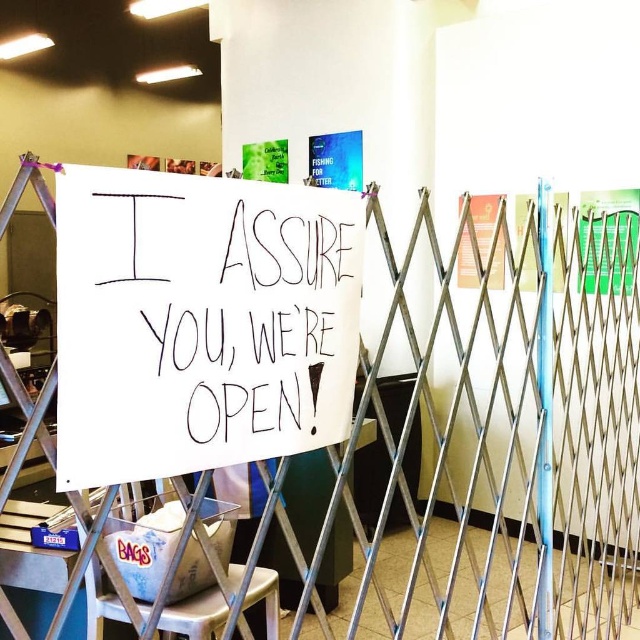
Does white paper sign at center have a greater height compared to metallic silver pole at right?

Incorrect, white paper sign at center's height is not larger of metallic silver pole at right's.

Between point (241, 401) and point (552, 600), which one is positioned in front?

Point (241, 401) is in front.

Does point (163, 339) come closer to viewer compared to point (545, 522)?

Yes, it is in front of point (545, 522).

Find the location of a particular element. white paper sign at center is located at coordinates pos(200,321).

Measure the distance between point (552, 412) and camera.

Point (552, 412) is 2.14 meters away from camera.

Find the location of a particular element. metallic silver pole at right is located at coordinates (545, 410).

How far apart are white paper sign at center and white plastic stool at lower left?

white paper sign at center is 35.29 inches from white plastic stool at lower left.

Describe the element at coordinates (200, 321) in the screenshot. This screenshot has width=640, height=640. I see `white paper sign at center` at that location.

What do you see at coordinates (200, 321) in the screenshot? I see `white paper sign at center` at bounding box center [200, 321].

Where is `white paper sign at center`? white paper sign at center is located at coordinates (200, 321).